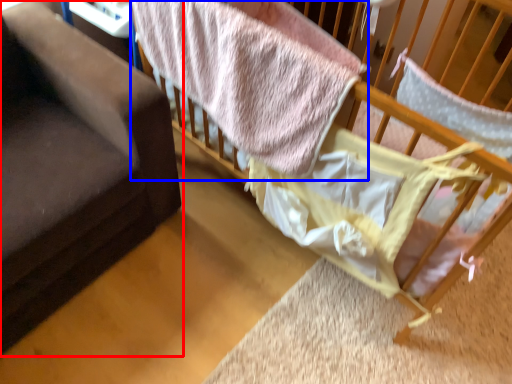
Question: Which of the following is the farthest to the observer, furniture (highlighted by a red box) or bed (highlighted by a blue box)?

Choices:
 (A) furniture
 (B) bed

Answer: (B)